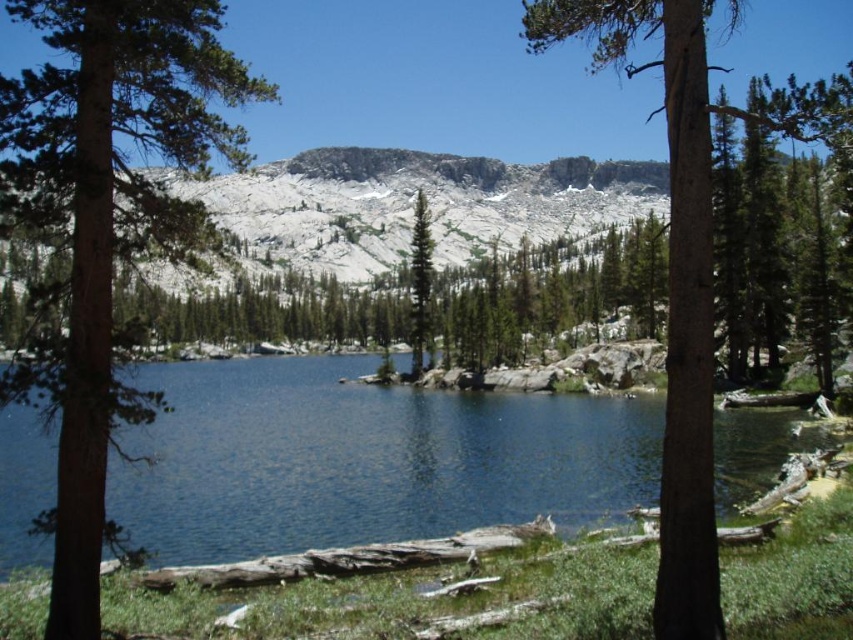
From the picture: Does deep blue water at center have a lesser width compared to green textured pine tree at center?

No.

Can you confirm if deep blue water at center is positioned to the left of green textured pine tree at center?

Correct, you'll find deep blue water at center to the left of green textured pine tree at center.

Does point (325, 429) come farther from viewer compared to point (428, 257)?

No, it is not.

Locate an element on the screen. deep blue water at center is located at coordinates (366, 460).

Does green matte tree at left have a lesser width compared to green textured pine tree at center?

No, green matte tree at left is not thinner than green textured pine tree at center.

Can you confirm if green matte tree at left is wider than green textured pine tree at center?

Yes, green matte tree at left is wider than green textured pine tree at center.

Between point (42, 36) and point (422, 202), which one is positioned in front?

Point (422, 202)

Locate an element on the screen. green matte tree at left is located at coordinates (107, 220).

Is brown rough bark tree at center taller than green textured pine tree at center?

Yes, brown rough bark tree at center is taller than green textured pine tree at center.

Is brown rough bark tree at center positioned behind green textured pine tree at center?

No, it is not.

At what (x,y) coordinates should I click in order to perform the action: click on brown rough bark tree at center. Please return your answer as a coordinate pair (x, y). The height and width of the screenshot is (640, 853). Looking at the image, I should click on (672, 280).

I want to click on brown rough bark tree at center, so click(672, 280).